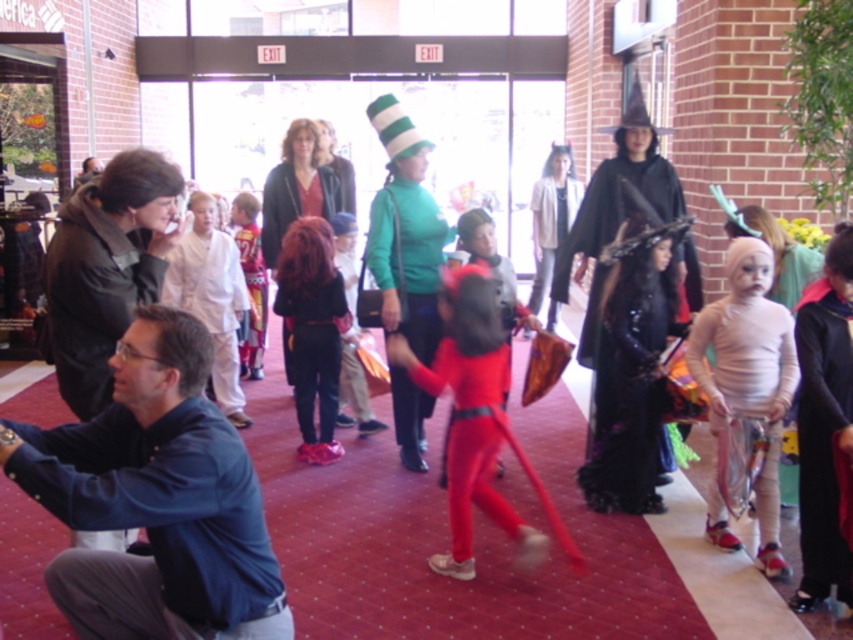
You are a photographer standing at the entrance of the hallway. You want to capture a photo that includes both the blue shirt at lower left and the matte white shirt at center. Given that your camera has a maximum focus range of 3 meters, will you be able to fit both subjects in the frame?

The blue shirt at lower left and the matte white shirt at center are 3.35 meters apart from each other. Since the distance exceeds the camera maximum focus range of 3 meters, you won not be able to fit both subjects in the frame.

You are standing in the hallway and want to take a photo of both the blue shirt at lower left and the black velvet cape at center. Which one should you aim the camera towards first to include both in the frame?

You should aim the camera towards the blue shirt at lower left first since it is positioned to the left of the black velvet cape at center, ensuring both are captured in the frame.